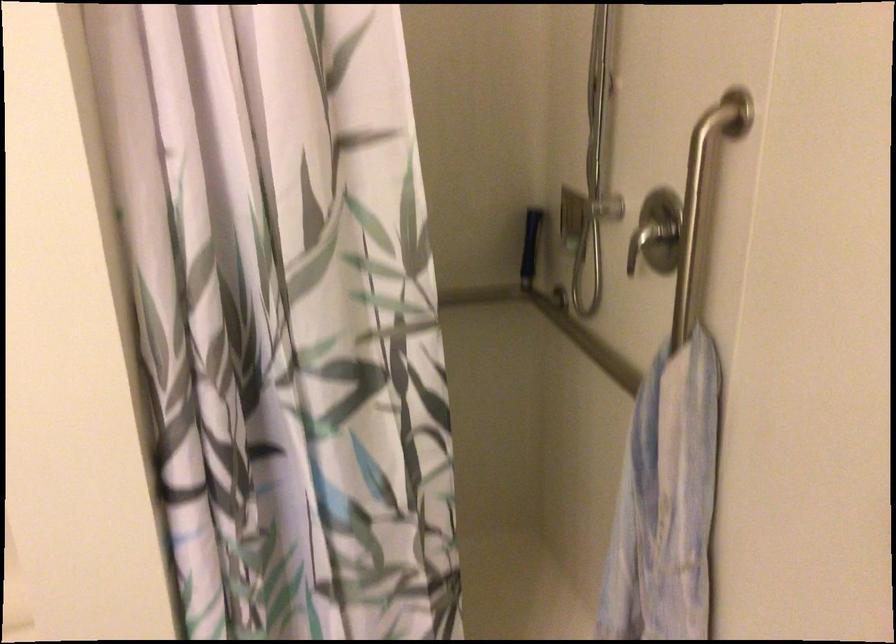
Image resolution: width=896 pixels, height=644 pixels. I want to click on shower faucet handle, so click(650, 240).